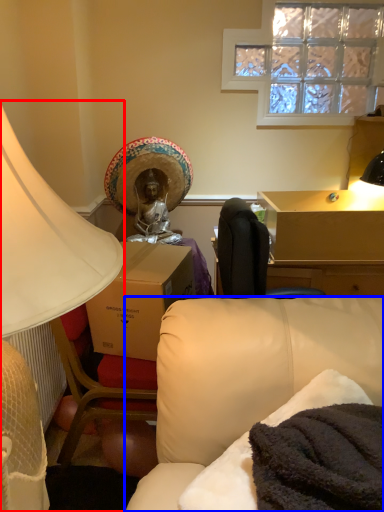
Question: Which of the following is the closest to the observer, lamp (highlighted by a red box) or studio couch (highlighted by a blue box)?

Choices:
 (A) lamp
 (B) studio couch

Answer: (A)